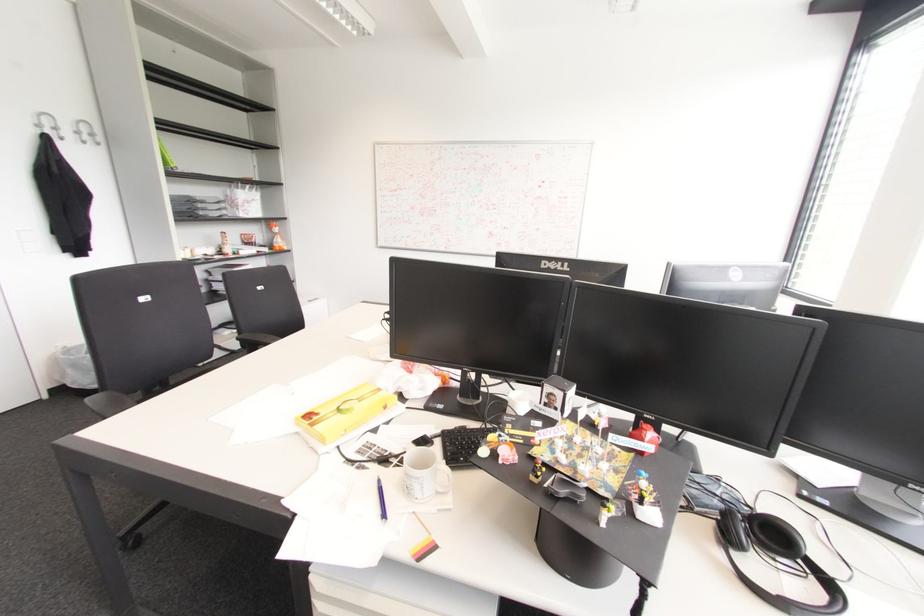
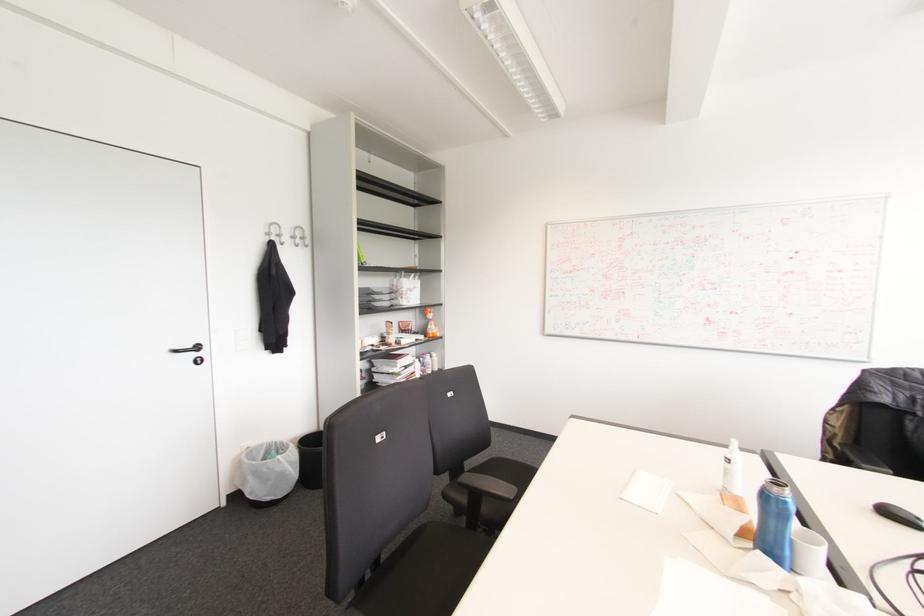
Find the pixel in the second image that matches pixel 91 135 in the first image.

(301, 238)